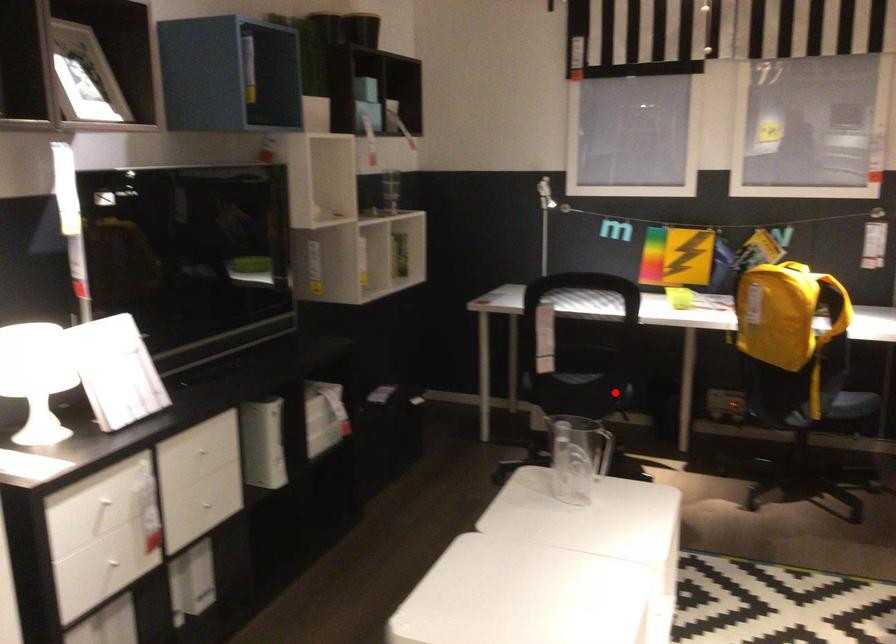
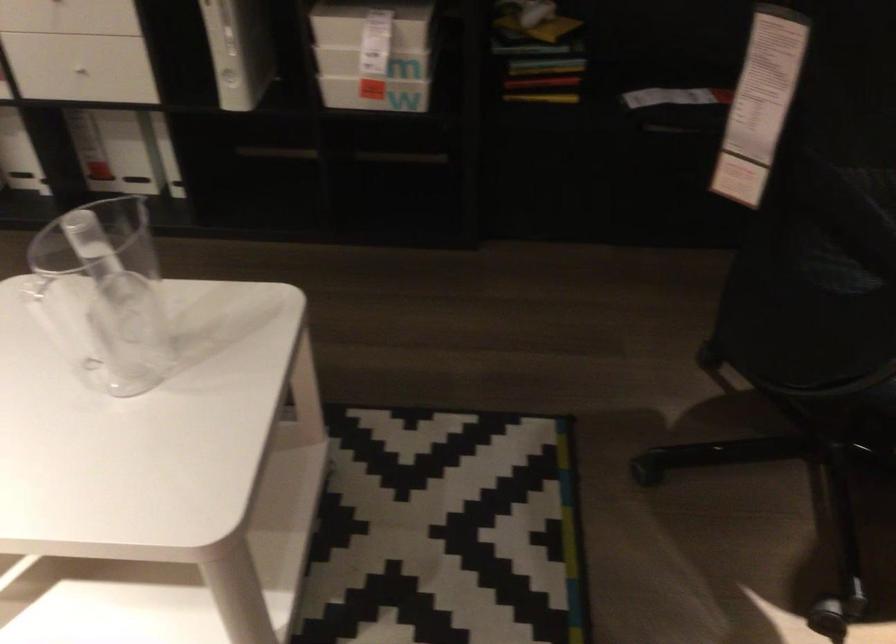
The point at the highlighted location is marked in the first image. Where is the corresponding point in the second image?

(837, 364)